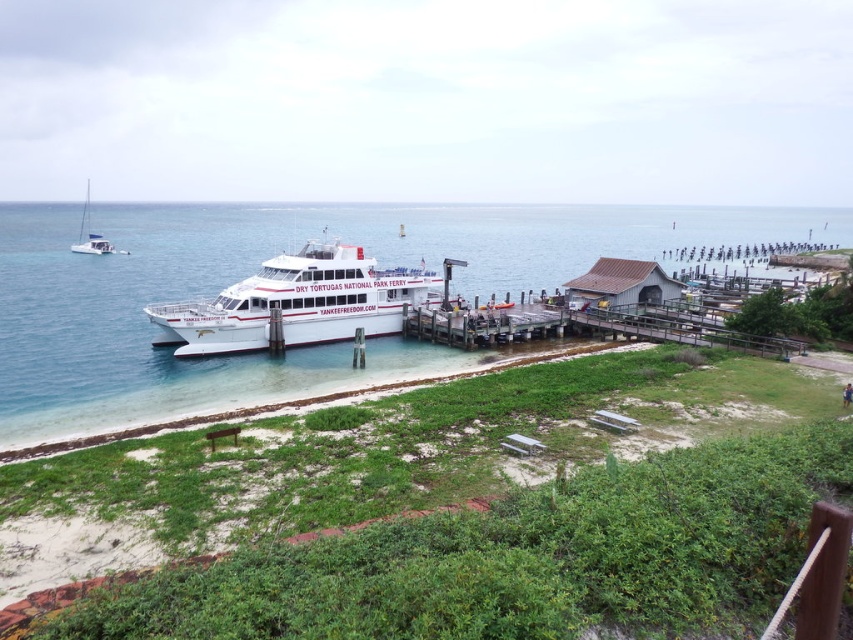
You are standing at the camera position observing the coastal scene with the ferry docked at the pier. There is a point marked at coordinates point [514,208]. Can you determine if this point is within a safe distance for a drone to land, considering the drone has a maximum operational distance of 200 meters?

The point [514,208] is 255.15 meters away from the camera, which exceeds the drone s maximum operational distance of 200 meters. Therefore, the point is too far for the drone to land safely.

You are standing on the pier and want to take a photo of the clear blue water at center. Where should you point your camera to capture it?

You should point your camera towards the coordinates point at point (x=259, y=268) to capture the clear blue water at center.

You are a photographer standing on the pier and want to capture both the white matte ferry at center and the white glossy sailboat at upper left in your shot. Which object will appear larger in your photo?

→ The white matte ferry at center will appear larger in your photo because it is closer to the viewer than the white glossy sailboat at upper left.